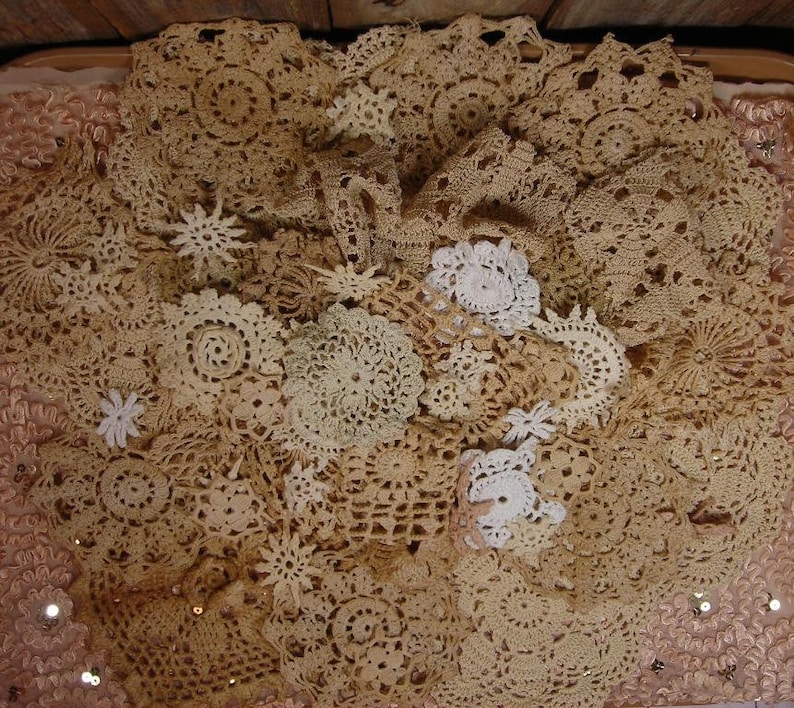
Where is `pink doily`? The width and height of the screenshot is (794, 708). pink doily is located at coordinates (27, 643).